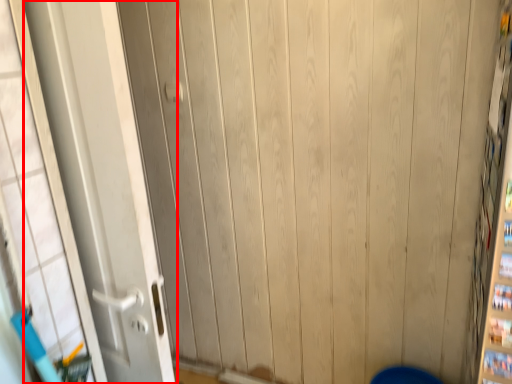
Question: Considering the relative positions of door (annotated by the red box) and door handle in the image provided, where is door (annotated by the red box) located with respect to the staircase?

Choices:
 (A) right
 (B) left

Answer: (B)